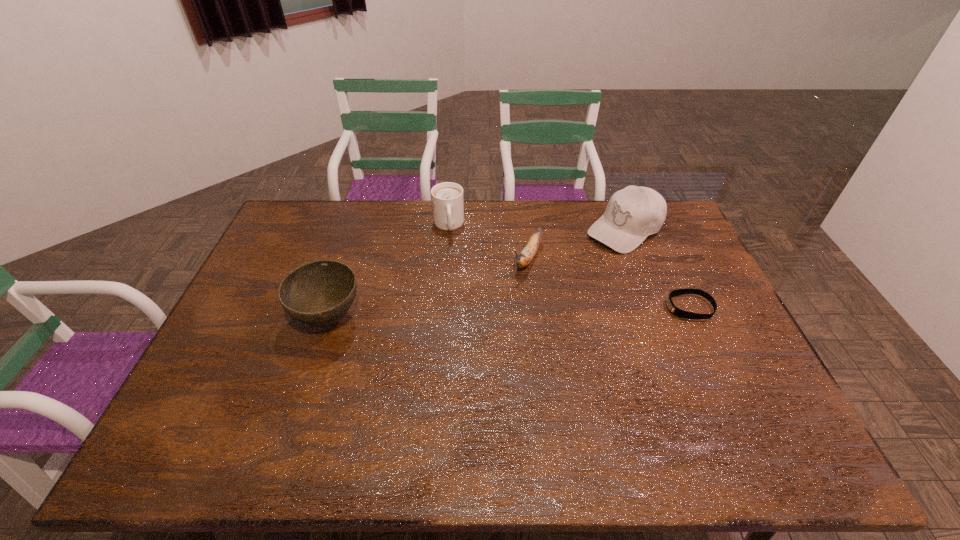
The width and height of the screenshot is (960, 540). Find the location of `vacant region located 0.390m on the front-facing side of the baseball cap`. vacant region located 0.390m on the front-facing side of the baseball cap is located at coordinates (520, 301).

This screenshot has width=960, height=540. In order to click on vacant region located 0.200m on the front-facing side of the baseball cap in this screenshot , I will do `click(562, 272)`.

At what (x,y) coordinates should I click in order to perform the action: click on blank space located on the front-facing side of the baseball cap. Please return your answer as a coordinate pair (x, y). Looking at the image, I should click on click(574, 264).

The width and height of the screenshot is (960, 540). What are the coordinates of `vacant region located at the stem of the banana` in the screenshot? It's located at (503, 301).

Locate an element on the screen. vacant area situated 0.090m at the stem of the banana is located at coordinates click(509, 293).

I want to click on vacant space located 0.380m at the stem of the banana, so click(x=464, y=362).

In order to click on vacant space located on the side with the handle of the fourth object from right to left in this screenshot , I will do `click(452, 273)`.

At what (x,y) coordinates should I click in order to perform the action: click on free point located 0.120m on the side with the handle of the fourth object from right to left. Please return your answer as a coordinate pair (x, y). The height and width of the screenshot is (540, 960). Looking at the image, I should click on (451, 263).

Find the location of a particular element. vacant space located 0.100m on the side with the handle of the fourth object from right to left is located at coordinates (451, 259).

The width and height of the screenshot is (960, 540). Identify the location of baseball cap that is at the far edge. (632, 214).